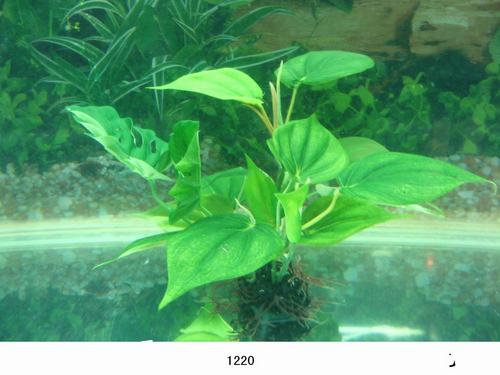
The height and width of the screenshot is (375, 500). I want to click on plant, so click(x=258, y=224), click(x=105, y=75), click(x=168, y=29), click(x=209, y=53).